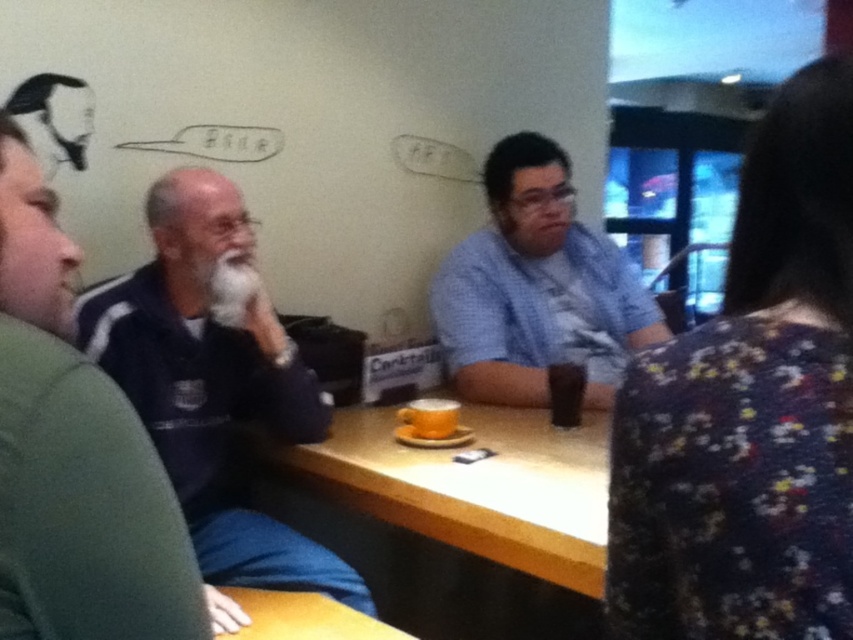
Can you confirm if blue checkered shirt at center is shorter than wooden table at lower center?

No.

Which of these two, blue checkered shirt at center or wooden table at lower center, stands taller?

With more height is blue checkered shirt at center.

You are a GUI agent. You are given a task and a screenshot of the screen. Output one action in this format:
    pyautogui.click(x=<x>, y=<y>)
    Task: Click on the blue checkered shirt at center
    The width and height of the screenshot is (853, 640).
    Given the screenshot: What is the action you would take?
    pyautogui.click(x=532, y=282)

Is dark blue fabric at left below blue checkered shirt at center?

Yes.

Can you confirm if dark blue fabric at left is positioned to the right of blue checkered shirt at center?

No, dark blue fabric at left is not to the right of blue checkered shirt at center.

This screenshot has width=853, height=640. What are the coordinates of `dark blue fabric at left` in the screenshot? It's located at (213, 381).

Is dark blue fabric at left taller than dark brown liquid at table center?

Correct, dark blue fabric at left is much taller as dark brown liquid at table center.

Who is higher up, dark blue fabric at left or dark brown liquid at table center?

dark brown liquid at table center

At what (x,y) coordinates should I click in order to perform the action: click on dark blue fabric at left. Please return your answer as a coordinate pair (x, y). This screenshot has width=853, height=640. Looking at the image, I should click on (213, 381).

The height and width of the screenshot is (640, 853). Identify the location of dark blue fabric at left. (213, 381).